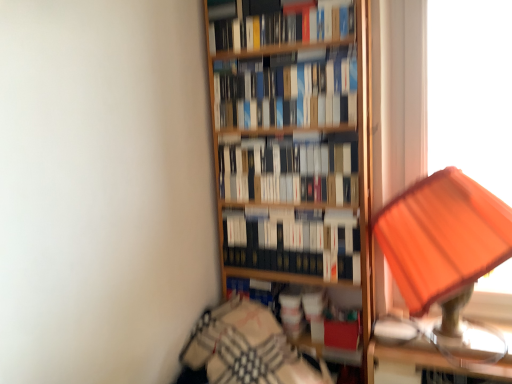
Question: Is hardcover books at upper center, which is the 1th book from top to bottom, facing away from hardcover books at center, which is counted as the 3th book, starting from the bottom?

Choices:
 (A) yes
 (B) no

Answer: (B)

Question: Is hardcover books at upper center, the fourth book in the bottom-to-top sequence, at the right side of hardcover books at center, which is counted as the 3th book, starting from the bottom?

Choices:
 (A) yes
 (B) no

Answer: (B)

Question: Could you tell me if hardcover books at upper center, which is the 1th book from top to bottom, is facing hardcover books at center, which is the second book in top-to-bottom order?

Choices:
 (A) yes
 (B) no

Answer: (B)

Question: Does hardcover books at upper center, which is the 1th book from top to bottom, lie behind hardcover books at center, which is counted as the 3th book, starting from the bottom?

Choices:
 (A) yes
 (B) no

Answer: (B)

Question: Is hardcover books at upper center, which is the 1th book from top to bottom, positioned beyond the bounds of hardcover books at center, which is counted as the 3th book, starting from the bottom?

Choices:
 (A) no
 (B) yes

Answer: (B)

Question: Based on their sizes in the image, would you say orange fabric lampshade at right is bigger or smaller than hardcover books at upper center, the fourth book in the bottom-to-top sequence?

Choices:
 (A) small
 (B) big

Answer: (B)

Question: Is orange fabric lampshade at right to the left or to the right of hardcover books at upper center, the fourth book in the bottom-to-top sequence, in the image?

Choices:
 (A) right
 (B) left

Answer: (A)

Question: Does point (434, 205) appear closer or farther from the camera than point (298, 14)?

Choices:
 (A) closer
 (B) farther

Answer: (A)

Question: Is orange fabric lampshade at right in front of or behind hardcover books at upper center, which is the 1th book from top to bottom, in the image?

Choices:
 (A) front
 (B) behind

Answer: (A)

Question: From their relative heights in the image, would you say hardcover books at center, which is counted as the 3th book, starting from the bottom, is taller or shorter than orange fabric lampshade at right?

Choices:
 (A) short
 (B) tall

Answer: (A)

Question: From the image's perspective, is hardcover books at center, which is the second book in top-to-bottom order, above or below orange fabric lampshade at right?

Choices:
 (A) above
 (B) below

Answer: (A)

Question: Relative to orange fabric lampshade at right, is hardcover books at center, which is counted as the 3th book, starting from the bottom, in front or behind?

Choices:
 (A) behind
 (B) front

Answer: (B)

Question: From a real-world perspective, is hardcover books at center, which is counted as the 3th book, starting from the bottom, above or below orange fabric lampshade at right?

Choices:
 (A) above
 (B) below

Answer: (A)

Question: From a real-world perspective, is hardcover books at center, which is counted as the 3th book, starting from the bottom, above or below hardcover books at center, marked as the fourth book in a top-to-bottom arrangement?

Choices:
 (A) below
 (B) above

Answer: (B)

Question: From the image's perspective, is hardcover books at center, which is the second book in top-to-bottom order, above or below hardcover books at center, marked as the fourth book in a top-to-bottom arrangement?

Choices:
 (A) below
 (B) above

Answer: (B)